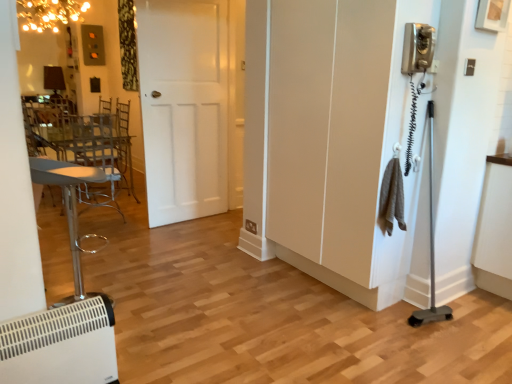
The height and width of the screenshot is (384, 512). I want to click on metallic silver swivel chair at left, so click(92, 155).

Identify the location of white plastic heater at lower left. click(61, 345).

Describe the element at coordinates (70, 210) in the screenshot. I see `white plastic heater at lower left` at that location.

In order to face white plastic heater at lower left, should I rotate leftwards or rightwards?

To face it directly, rotate left by 23.436 degrees.

Where is `white matte screen door at right`? This screenshot has height=384, width=512. white matte screen door at right is located at coordinates (328, 128).

Is white matte screen door at right positioned behind metallic silver swivel chair at left?

No, white matte screen door at right is closer to the camera.

Is point (301, 24) positioned in front of point (92, 196)?

Yes, it is.

From the image's perspective, is white matte screen door at right located beneath metallic silver swivel chair at left?

No.

Considering the sizes of objects white matte screen door at right and white matte door at center in the image provided, who is taller, white matte screen door at right or white matte door at center?

white matte door at center.

Considering the relative positions of white matte screen door at right and white matte door at center in the image provided, is white matte screen door at right behind white matte door at center?

No, it is in front of white matte door at center.

Is white matte screen door at right situated inside white matte door at center or outside?

white matte screen door at right is located beyond the bounds of white matte door at center.

Is white matte screen door at right positioned with its back to white matte door at center?

No, white matte screen door at right's orientation is not away from white matte door at center.

In terms of size, does white plastic heater at lower left appear bigger or smaller than white matte screen door at right?

white plastic heater at lower left is smaller than white matte screen door at right.

Based on the photo, is white plastic heater at lower left facing away from white matte screen door at right?

No.

Are white plastic heater at lower left and white matte screen door at right located far from each other?

white plastic heater at lower left is positioned a significant distance from white matte screen door at right.

From the image's perspective, which is above, white plastic heater at lower left or white matte screen door at right?

white matte screen door at right, from the image's perspective.

Is white plastic heater at lower left facing towards white matte door at center?

No.

From a real-world perspective, is white plastic heater at lower left physically above white matte door at center?

Incorrect, from a real-world perspective, white plastic heater at lower left is lower than white matte door at center.

Is white plastic heater at lower left placed right next to white matte door at center?

There is a gap between white plastic heater at lower left and white matte door at center.

Does white plastic heater at lower left have a greater width compared to white matte door at center?

Correct, the width of white plastic heater at lower left exceeds that of white matte door at center.

Considering the sizes of objects white matte door at center and metallic silver swivel chair at left in the image provided, who is taller, white matte door at center or metallic silver swivel chair at left?

white matte door at center.

In the scene shown: Is white matte door at center smaller than metallic silver swivel chair at left?

Yes, white matte door at center is smaller than metallic silver swivel chair at left.

Between white matte door at center and metallic silver swivel chair at left, which one has larger width?

With larger width is metallic silver swivel chair at left.

Which is behind, point (332, 233) or point (98, 178)?

The point (98, 178) is more distant.

From a real-world perspective, is white matte screen door at right physically below white plastic heater at lower left?

No, from a real-world perspective, white matte screen door at right is not beneath white plastic heater at lower left.

Considering the positions of objects white matte screen door at right and white plastic heater at lower left in the image provided, who is more to the right, white matte screen door at right or white plastic heater at lower left?

white matte screen door at right.

From the image's perspective, relative to white matte screen door at right, is white matte door at center above or below?

Clearly, from the image's perspective, white matte door at center is above white matte screen door at right.

Is point (217, 77) closer or farther from the camera than point (283, 37)?

Clearly, point (217, 77) is more distant from the camera than point (283, 37).

At what (x,y) coordinates should I click in order to perform the action: click on screen door on the right side of metallic silver swivel chair at left. Please return your answer as a coordinate pair (x, y). Looking at the image, I should click on (328, 128).

Find the location of `door on the left side of white matte screen door at right`. door on the left side of white matte screen door at right is located at coordinates click(x=184, y=106).

From the image, which object appears to be nearer to white plastic heater at lower left, white matte door at center or white matte screen door at right?

white matte door at center is positioned closer to the anchor white plastic heater at lower left.

Considering their positions, is white plastic heater at lower left positioned further to white matte screen door at right than white matte door at center?

white plastic heater at lower left lies further to white matte screen door at right than the other object.

When comparing their distances from metallic silver swivel chair at left, does white plastic heater at lower left or white matte door at center seem closer?

white plastic heater at lower left is closer to metallic silver swivel chair at left.

Based on their spatial positions, is white plastic heater at lower left or white plastic heater at lower left further from metallic silver swivel chair at left?

white plastic heater at lower left.

From the image, which object appears to be nearer to white matte door at center, white plastic heater at lower left or white plastic heater at lower left?

white plastic heater at lower left is closer to white matte door at center.

Which object lies further to the anchor point white matte screen door at right, white plastic heater at lower left or metallic silver swivel chair at left?

metallic silver swivel chair at left.

Which object lies further to the anchor point white matte door at center, metallic silver swivel chair at left or white plastic heater at lower left?

white plastic heater at lower left lies further to white matte door at center than the other object.

Which object lies further to the anchor point metallic silver swivel chair at left, white plastic heater at lower left or white matte screen door at right?

white matte screen door at right is further to metallic silver swivel chair at left.

Where is `furniture positioned between white plastic heater at lower left and metallic silver swivel chair at left from near to far`? This screenshot has height=384, width=512. furniture positioned between white plastic heater at lower left and metallic silver swivel chair at left from near to far is located at coordinates (70, 210).

You are a GUI agent. You are given a task and a screenshot of the screen. Output one action in this format:
    pyautogui.click(x=<x>, y=<y>)
    Task: Click on the screen door between white plastic heater at lower left and white matte door at center in the front-back direction
    The height and width of the screenshot is (384, 512).
    Given the screenshot: What is the action you would take?
    pyautogui.click(x=328, y=128)

You are a GUI agent. You are given a task and a screenshot of the screen. Output one action in this format:
    pyautogui.click(x=<x>, y=<y>)
    Task: Click on the door positioned between white plastic heater at lower left and metallic silver swivel chair at left from near to far
    Image resolution: width=512 pixels, height=384 pixels.
    Given the screenshot: What is the action you would take?
    pyautogui.click(x=184, y=106)

Identify the location of door between white plastic heater at lower left and white matte screen door at right in the horizontal direction. (184, 106).